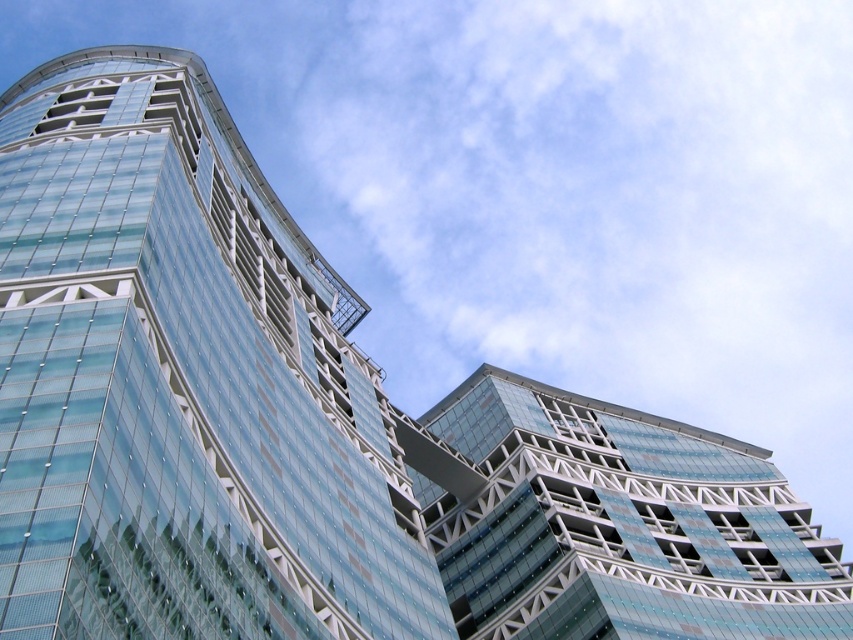
Which is behind, point (224, 266) or point (579, 449)?

Positioned behind is point (579, 449).

Is the position of transparent glass building at center less distant than that of transparent glass building at upper right?

Yes.

Identify the location of transparent glass building at center. (183, 384).